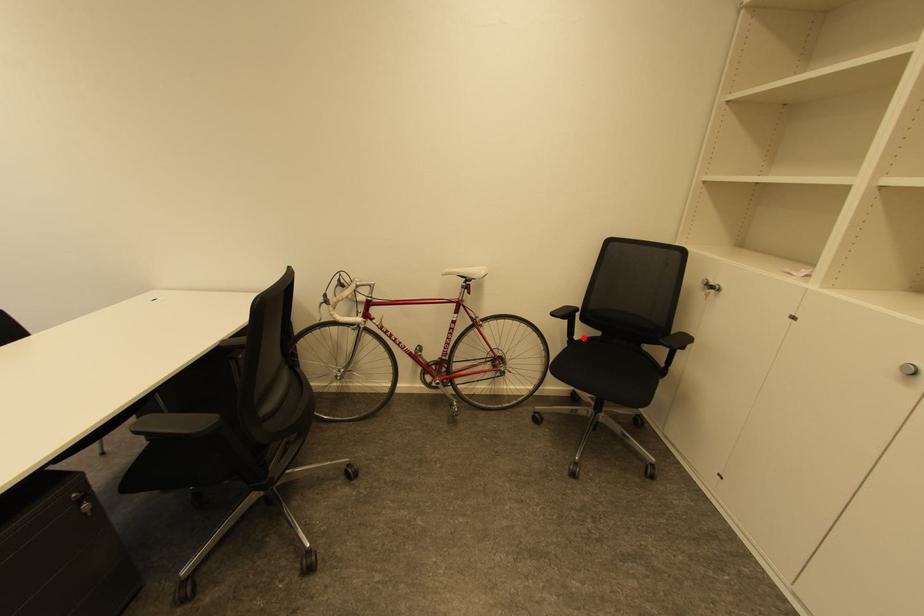
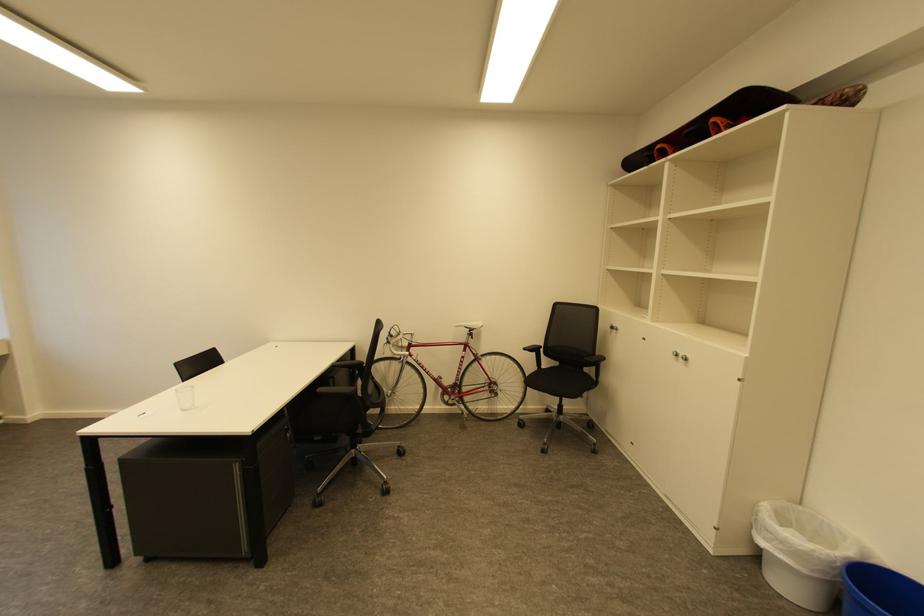
Locate, in the second image, the point that corresponds to the highlighted location in the first image.

(551, 368)